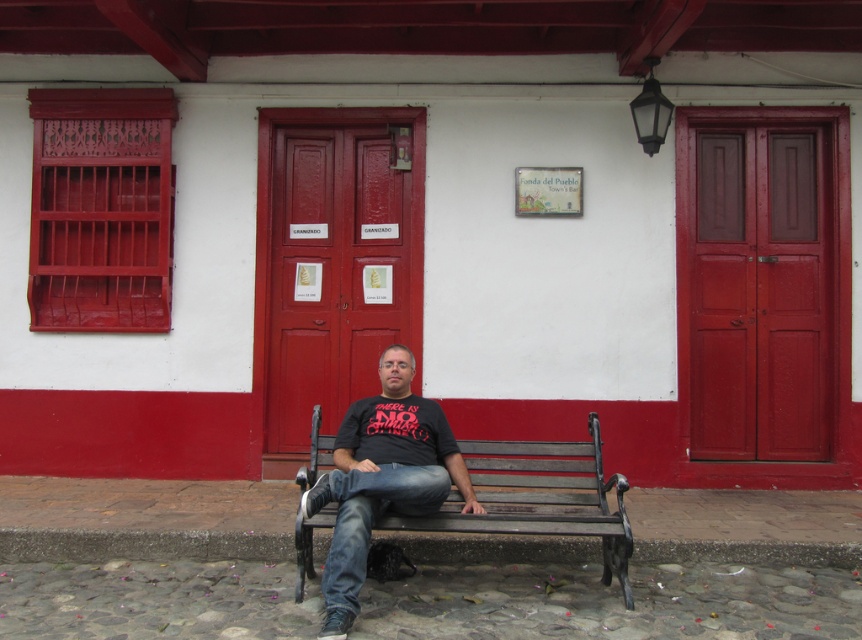
Who is shorter, black matte shirt at center or wooden bench at center?

With less height is wooden bench at center.

This screenshot has height=640, width=862. I want to click on black matte shirt at center, so click(x=382, y=477).